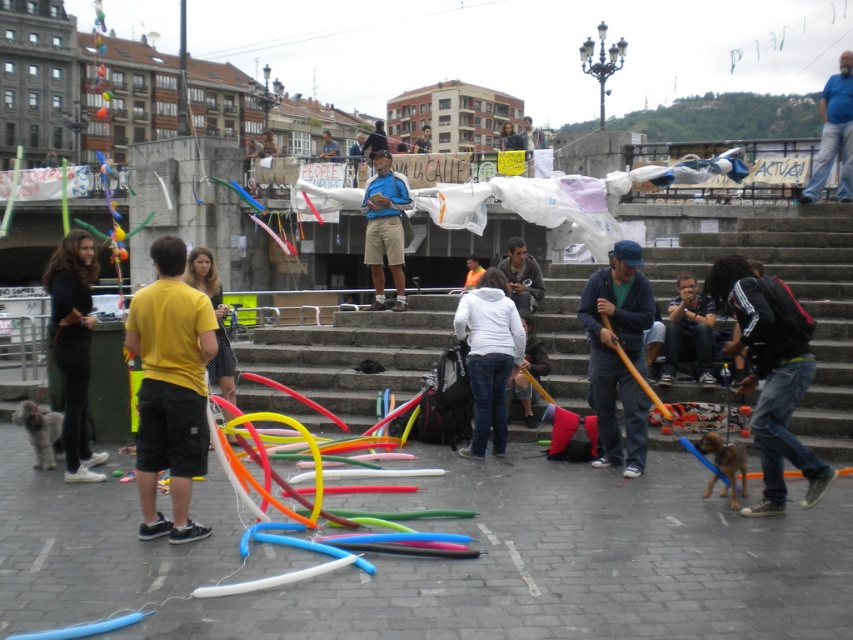
Does matte blue jacket at center appear under blue denim jeans at center?

Indeed, matte blue jacket at center is positioned under blue denim jeans at center.

Who is lower down, matte blue jacket at center or blue denim jeans at center?

matte blue jacket at center is lower down.

Between point (593, 388) and point (849, 129), which one is positioned behind?

Positioned behind is point (849, 129).

You are a GUI agent. You are given a task and a screenshot of the screen. Output one action in this format:
    pyautogui.click(x=<x>, y=<y>)
    Task: Click on the matte blue jacket at center
    
    Given the screenshot: What is the action you would take?
    pyautogui.click(x=618, y=355)

Who is lower down, matte blue jacket at center or white matte hoodie at center?

white matte hoodie at center is lower down.

Who is more distant from viewer, (601,406) or (477,390)?

Positioned behind is point (477,390).

Is point (631, 477) positioned after point (479, 369)?

No, it is in front of (479, 369).

This screenshot has width=853, height=640. I want to click on matte blue jacket at center, so click(618, 355).

Does matte blue shirt at center have a lesser width compared to blue denim jeans at center?

Indeed, matte blue shirt at center has a lesser width compared to blue denim jeans at center.

Measure the distance between matte blue shirt at center and blue denim jeans at center.

matte blue shirt at center is 74.53 feet from blue denim jeans at center.

Where is `matte blue shirt at center`? This screenshot has height=640, width=853. matte blue shirt at center is located at coordinates (x=386, y=227).